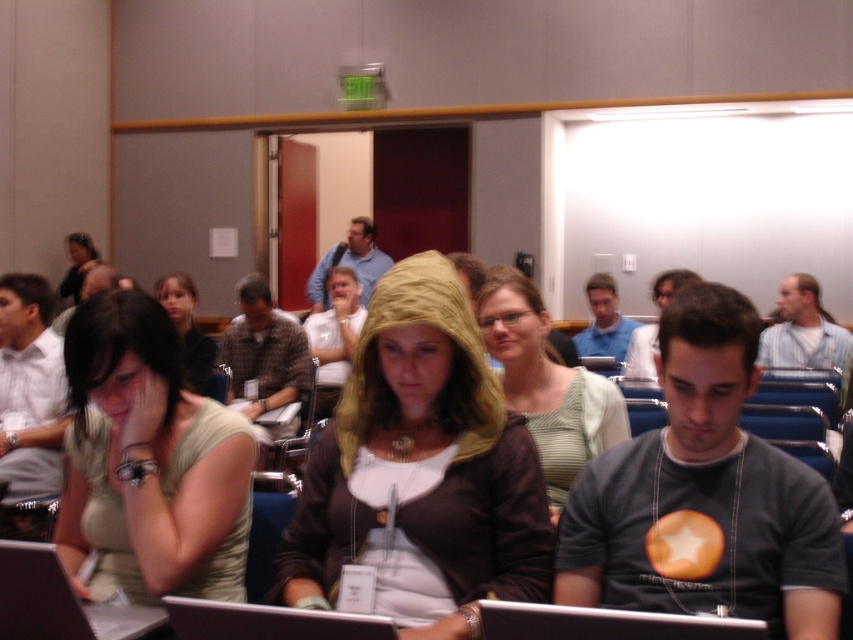
You are a delivery robot in a conference room. You need to deliver a package to the person wearing the green matte shirt at center. There is an obstacle in the form of a matte black hoodie at center blocking your path. Can you navigate around the obstacle if your turning radius is 1.5 meters?

The distance between the green matte shirt at center and the matte black hoodie at center is 2.19 meters. Since the turning radius required is 1.5 meters, which is less than the available distance, the robot can navigate around the obstacle.

You are organizing a group photo and need to arrange two people wearing the matte gold hoodie at center and the green striped shirt at center side by side. Which clothing item should be placed on the left to ensure the wider one is on the left for better visual balance?

The matte gold hoodie at center should be placed on the left since its width is larger than the green striped shirt at center, ensuring the wider item is on the left for better visual balance.

You are organizing a clothing donation drive and need to determine if the green matte shirt at center and the matte black hoodie at center can fit into a standard donation box that measures 30x20x10 inches. Based on their sizes, will both items fit inside the box?

The green matte shirt at center is smaller than the matte black hoodie at center. Since the hoodie is larger, it is important to check if both can fit in the box. However, without specific size measurements, it is impossible to definitively determine if they will fit into the 30x20x10 inches donation box. More information about their exact dimensions is needed.